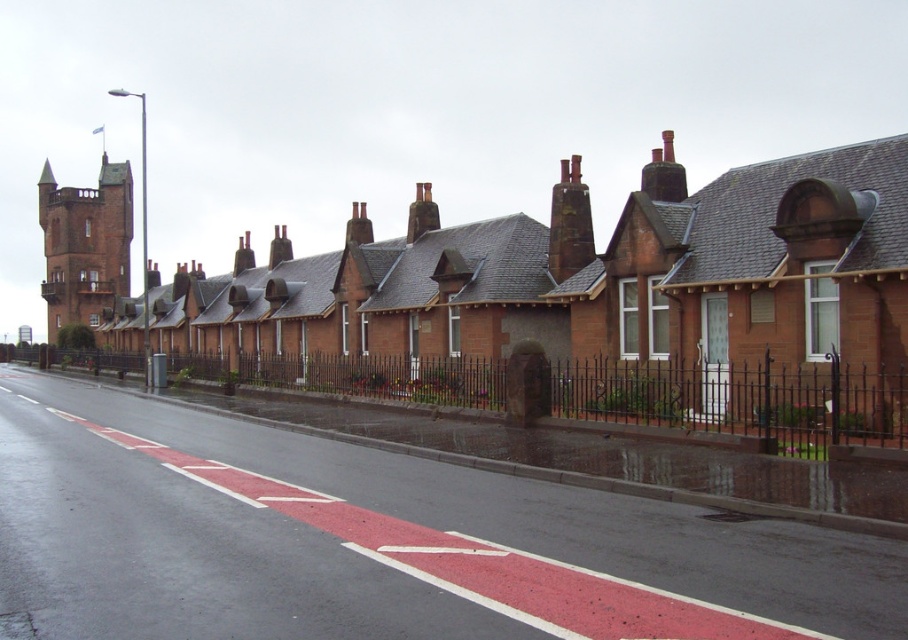
Question: Which point appears farthest from the camera in this image?

Choices:
 (A) (408, 552)
 (B) (883, 424)
 (C) (579, 177)

Answer: (C)

Question: Is red asphalt road at center to the right of red brick chimney at left from the viewer's perspective?

Choices:
 (A) no
 (B) yes

Answer: (B)

Question: Which point is farther to the camera?

Choices:
 (A) (47, 259)
 (B) (292, 573)
 (C) (673, 204)
 (D) (553, 250)

Answer: (A)

Question: Which of the following is the closest to the observer?

Choices:
 (A) matte brick church at center
 (B) rusty metal chimney at center
 (C) red asphalt road at center

Answer: (C)

Question: Does red brick chimney at left appear on the right side of rusty metal chimney at center?

Choices:
 (A) yes
 (B) no

Answer: (B)

Question: Observing the image, what is the correct spatial positioning of red asphalt road at center in reference to matte brick church at center?

Choices:
 (A) below
 (B) above

Answer: (A)